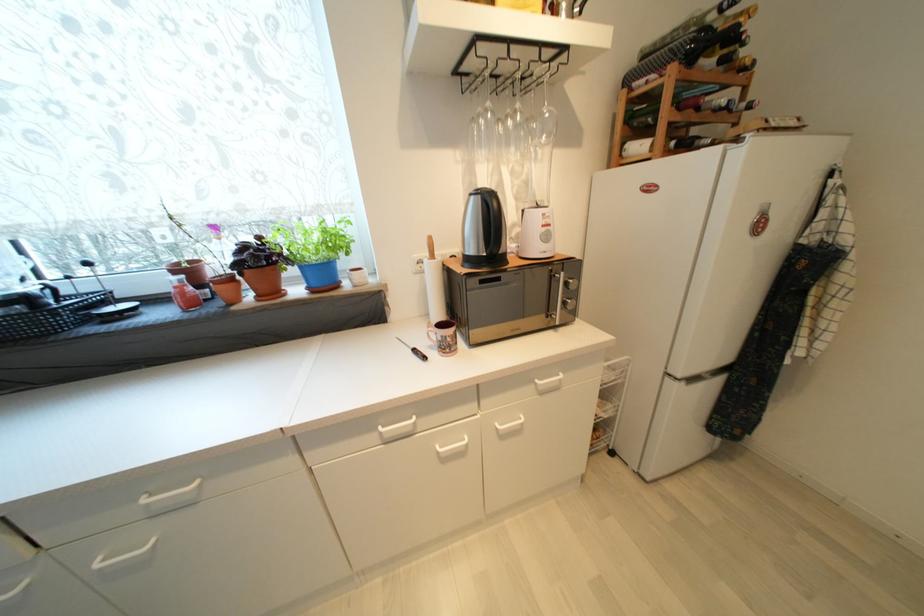
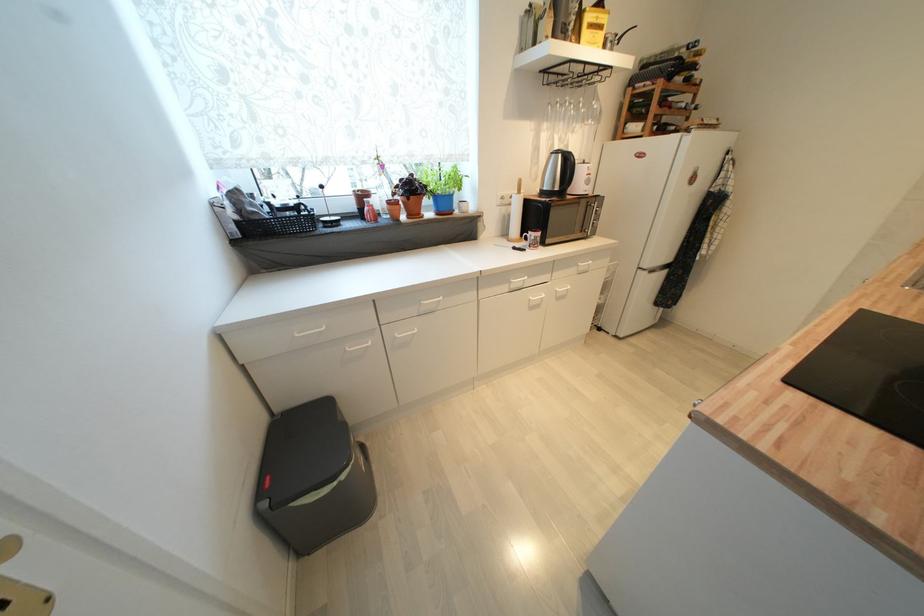
Locate, in the second image, the point that corresponds to (x=276, y=293) in the first image.

(419, 216)